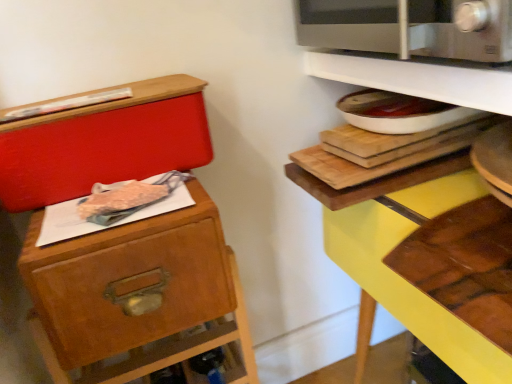
Question: Are matte red box at upper left and satin silver microwave at upper right beside each other?

Choices:
 (A) no
 (B) yes

Answer: (A)

Question: Is matte red box at upper left shorter than satin silver microwave at upper right?

Choices:
 (A) no
 (B) yes

Answer: (A)

Question: Does matte red box at upper left come in front of satin silver microwave at upper right?

Choices:
 (A) no
 (B) yes

Answer: (A)

Question: Considering the relative sizes of matte red box at upper left and satin silver microwave at upper right in the image provided, is matte red box at upper left wider than satin silver microwave at upper right?

Choices:
 (A) no
 (B) yes

Answer: (A)

Question: From a real-world perspective, is matte red box at upper left located beneath satin silver microwave at upper right?

Choices:
 (A) yes
 (B) no

Answer: (A)

Question: Is matte red box at upper left taller or shorter than wooden drawer at left?

Choices:
 (A) short
 (B) tall

Answer: (A)

Question: From the image's perspective, is matte red box at upper left above or below wooden drawer at left?

Choices:
 (A) above
 (B) below

Answer: (A)

Question: Is matte red box at upper left wider or thinner than wooden drawer at left?

Choices:
 (A) thin
 (B) wide

Answer: (B)

Question: Is matte red box at upper left situated inside wooden drawer at left or outside?

Choices:
 (A) outside
 (B) inside

Answer: (A)

Question: Do you think satin silver microwave at upper right is within yellow wood shelf at upper right, which ranks as the 2th shelf in top-to-bottom order, or outside of it?

Choices:
 (A) inside
 (B) outside

Answer: (B)

Question: From the image's perspective, is satin silver microwave at upper right located above or below yellow wood shelf at upper right, which ranks as the 2th shelf in top-to-bottom order?

Choices:
 (A) below
 (B) above

Answer: (B)

Question: From a real-world perspective, is satin silver microwave at upper right positioned above or below yellow wood shelf at upper right, which ranks as the 2th shelf in top-to-bottom order?

Choices:
 (A) below
 (B) above

Answer: (B)

Question: Is satin silver microwave at upper right to the left or to the right of yellow wood shelf at upper right, which appears as the 1th shelf when ordered from the bottom, in the image?

Choices:
 (A) right
 (B) left

Answer: (B)

Question: Does point (109, 347) appear closer or farther from the camera than point (381, 79)?

Choices:
 (A) farther
 (B) closer

Answer: (B)

Question: Is wooden drawer at left to the left or to the right of white glossy shelf at upper right, the 2th shelf when ordered from bottom to top, in the image?

Choices:
 (A) left
 (B) right

Answer: (A)